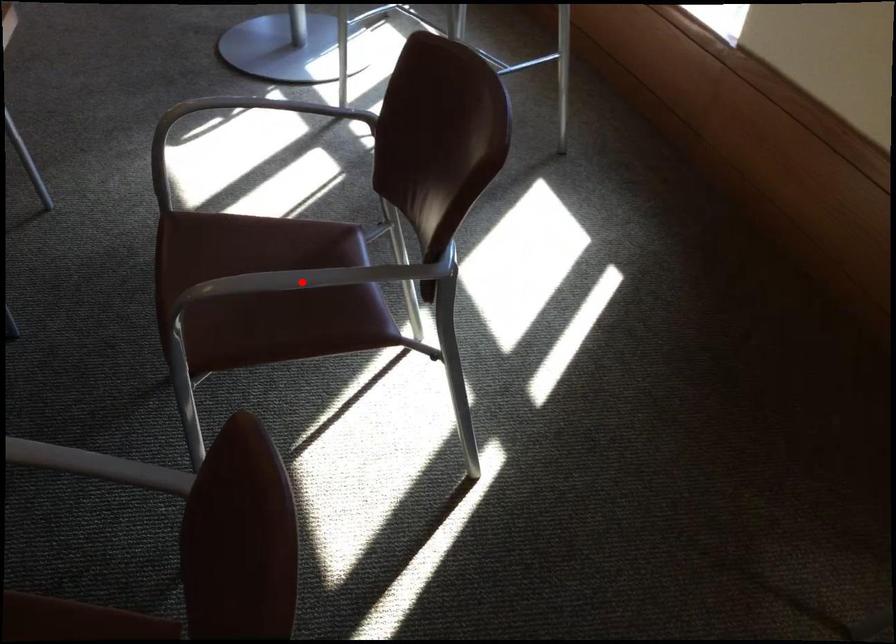
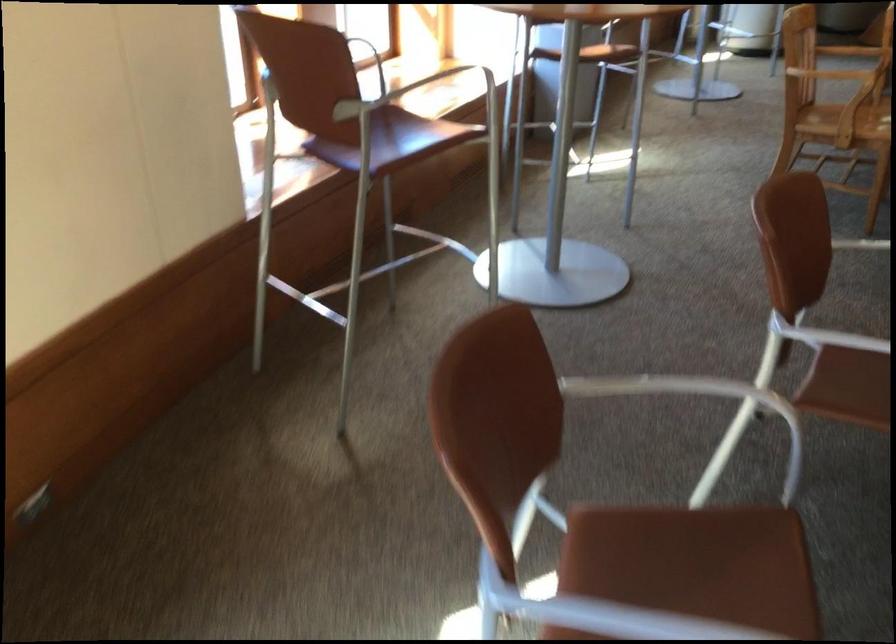
Question: I am providing you with two images of the same scene from different viewpoints. A red point is marked on the first image. Can you still see the location of the red point in image 2?

Choices:
 (A) Yes
 (B) No

Answer: (B)